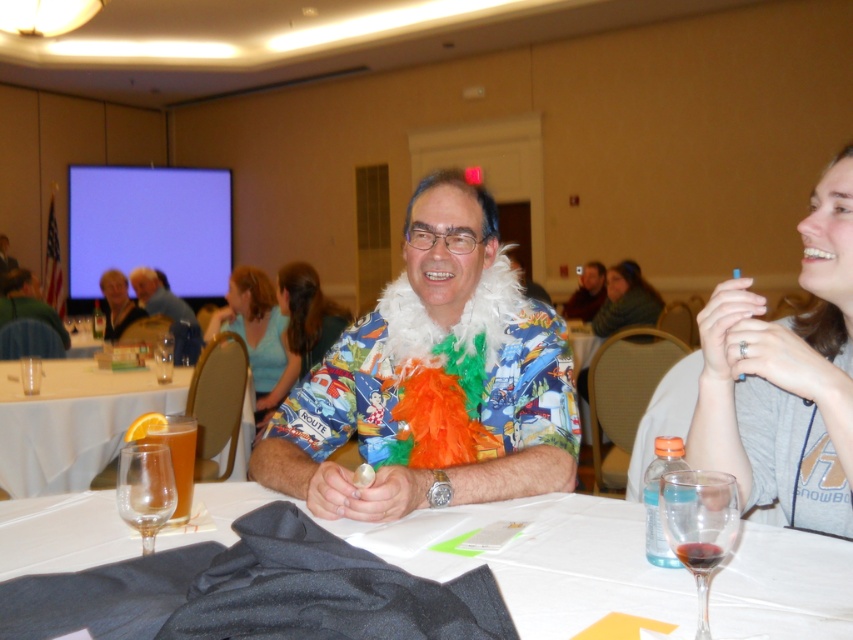
Is point (306, 349) in front of point (123, 484)?

No, (306, 349) is behind (123, 484).

Between printed fabric shirt at center and transparent glass at table front, which one appears on the left side from the viewer's perspective?

printed fabric shirt at center

Who is more distant from viewer, (279, 305) or (135, 497)?

Point (279, 305)

In order to click on printed fabric shirt at center in this screenshot , I will do `click(300, 330)`.

Between silky black fabric at center and blue fabric shirt at center, which one appears on the right side from the viewer's perspective?

silky black fabric at center is more to the right.

Is silky black fabric at center positioned before blue fabric shirt at center?

Yes, silky black fabric at center is in front of blue fabric shirt at center.

Identify the location of silky black fabric at center. (x=567, y=564).

Identify the location of silky black fabric at center. The width and height of the screenshot is (853, 640). (567, 564).

Can you confirm if transparent glass at lower right is positioned to the left of matte black shirt at upper left?

No, transparent glass at lower right is not to the left of matte black shirt at upper left.

Who is higher up, transparent glass at lower right or matte black shirt at upper left?

matte black shirt at upper left is higher up.

Where is `transparent glass at lower right`? The height and width of the screenshot is (640, 853). transparent glass at lower right is located at coordinates (699, 525).